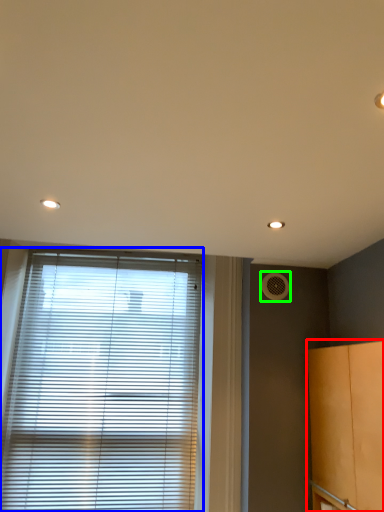
Question: Estimate the real-world distances between objects in this image. Which object is closer to cabinetry (highlighted by a red box), window blind (highlighted by a blue box) or air conditioning (highlighted by a green box)?

Choices:
 (A) window blind
 (B) air conditioning

Answer: (B)